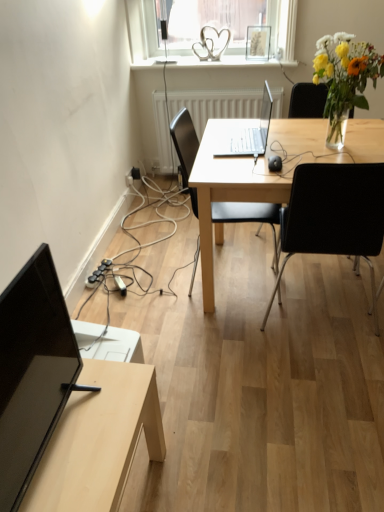
What are the coordinates of `vacant area on top of light wood table at lower left (from a real-world perspective)` in the screenshot? It's located at (87, 421).